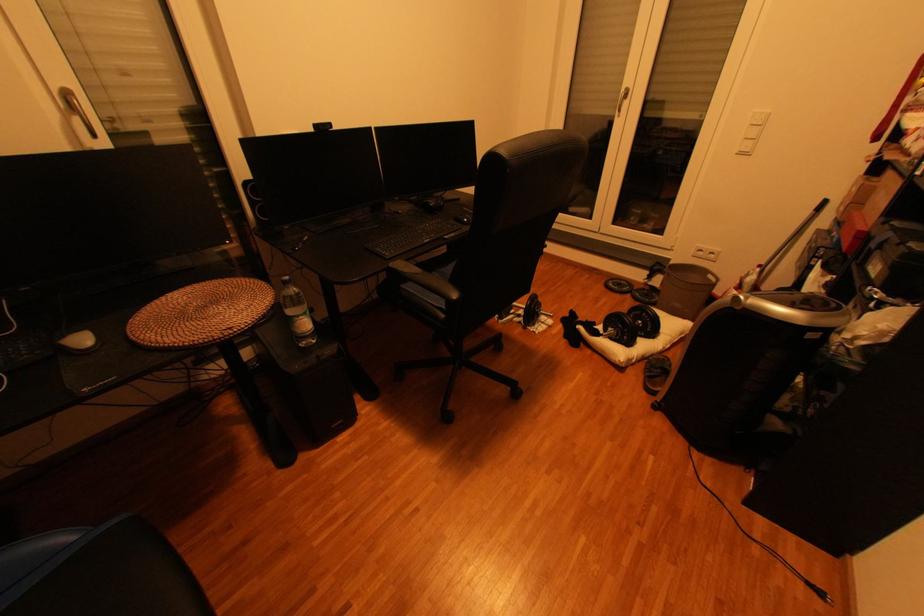
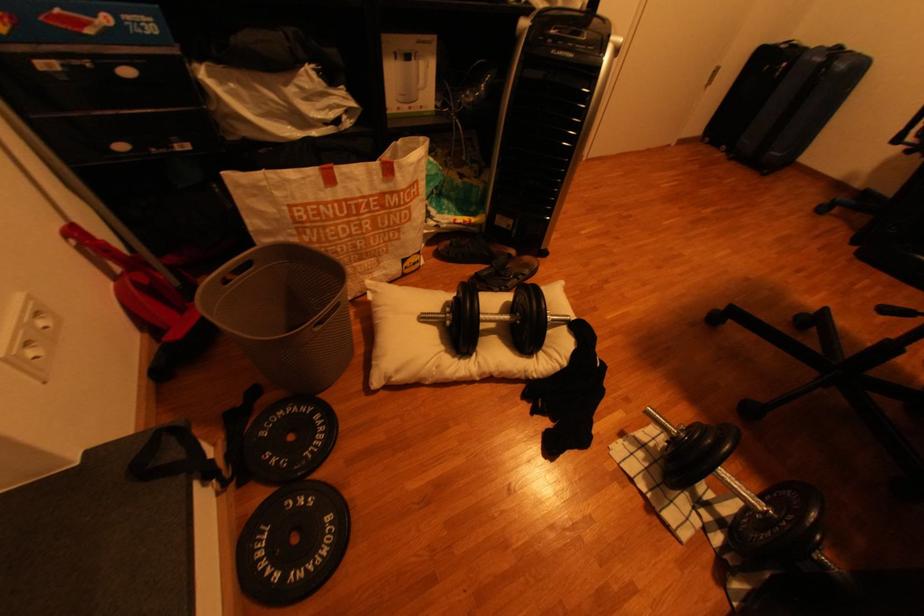
Where in the second image is the point corresponding to pixel 635 284 from the first image?

(274, 540)